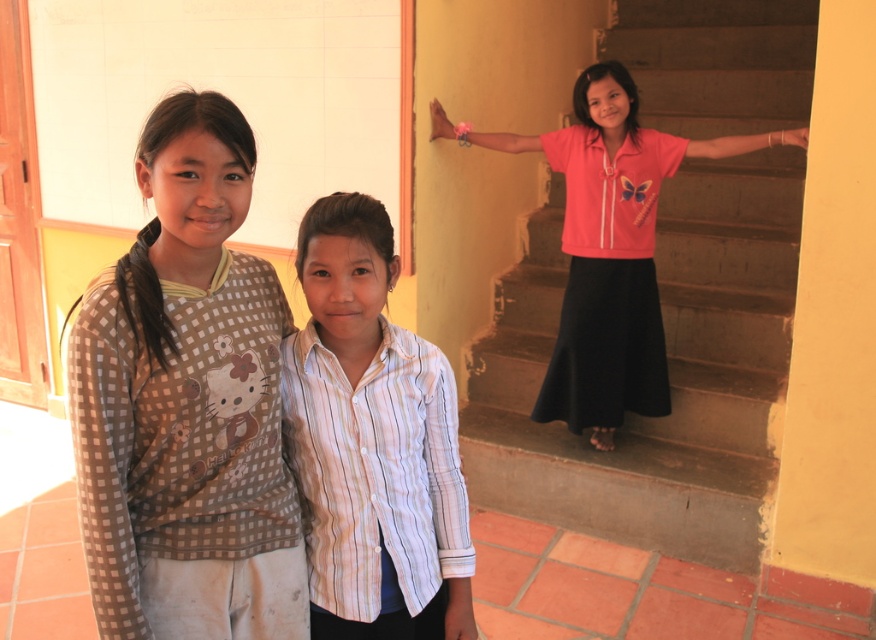
Question: Is brown checkered shirt at left closer to camera compared to pink satin blouse at upper right?

Choices:
 (A) yes
 (B) no

Answer: (A)

Question: Can you confirm if white striped shirt at center is positioned above pink satin blouse at upper right?

Choices:
 (A) yes
 (B) no

Answer: (B)

Question: Which object appears farthest from the camera in this image?

Choices:
 (A) white striped shirt at center
 (B) pink satin blouse at upper right

Answer: (B)

Question: Which object is the farthest from the brown checkered shirt at left?

Choices:
 (A) pink satin blouse at upper right
 (B) white striped shirt at center

Answer: (A)

Question: Does brown checkered shirt at left lie in front of white striped shirt at center?

Choices:
 (A) no
 (B) yes

Answer: (B)

Question: Which is nearer to the white striped shirt at center?

Choices:
 (A) pink satin blouse at upper right
 (B) brown checkered shirt at left

Answer: (B)